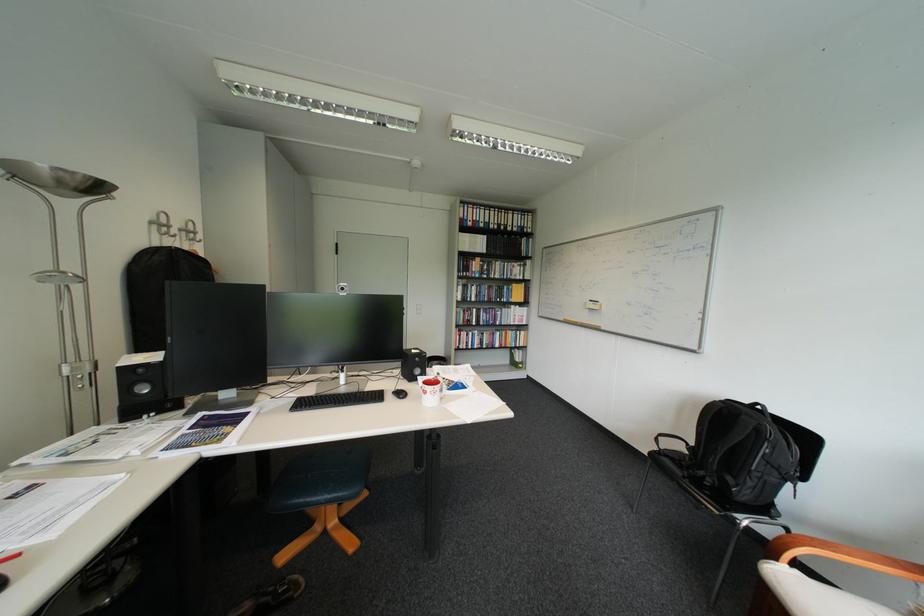
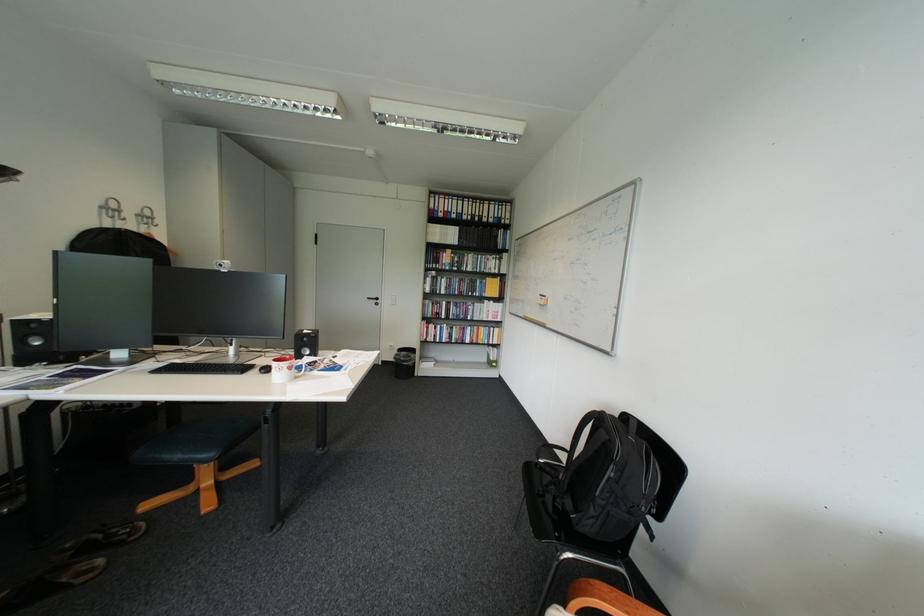
Locate, in the second image, the point that corresponds to (x=610, y=464) in the first image.

(523, 472)